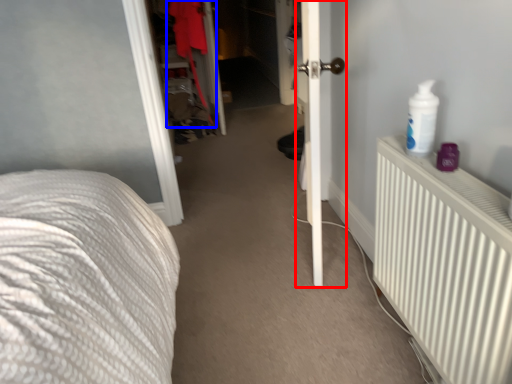
Question: Which point is further to the camera, door (highlighted by a red box) or clothing (highlighted by a blue box)?

Choices:
 (A) door
 (B) clothing

Answer: (B)